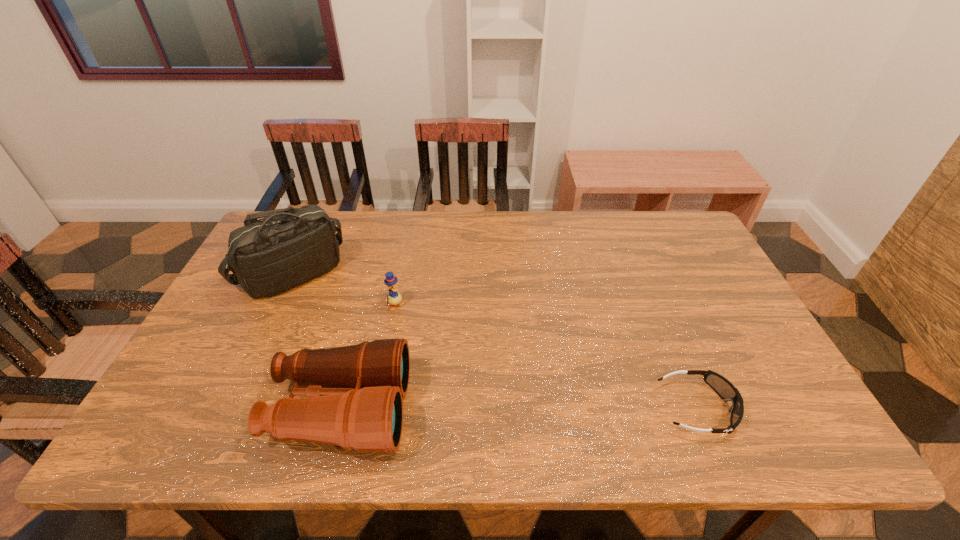
This screenshot has height=540, width=960. Identify the location of vacant space on the desktop that is between the third shortest object and the shortest object and is positioned on the face of the second shortest object, where the monocle is placed. (507, 409).

Image resolution: width=960 pixels, height=540 pixels. In order to click on vacant space on the desktop that is between the third shortest object and the goggles and is positioned at the front padded panel of the tallest object in this screenshot , I will do `click(484, 409)`.